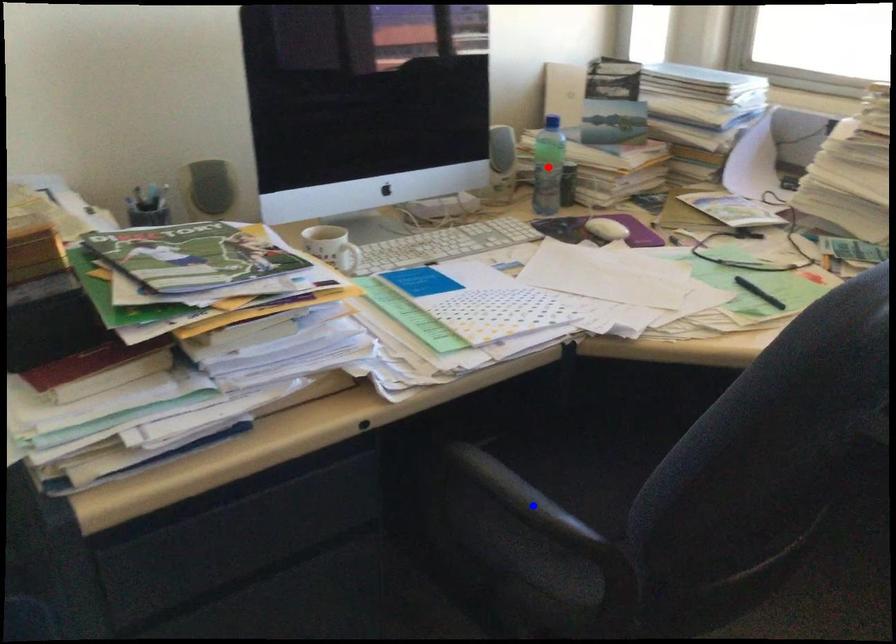
Question: Which of the two points in the image is closer to the camera?

Choices:
 (A) Blue point is closer.
 (B) Red point is closer.

Answer: (A)